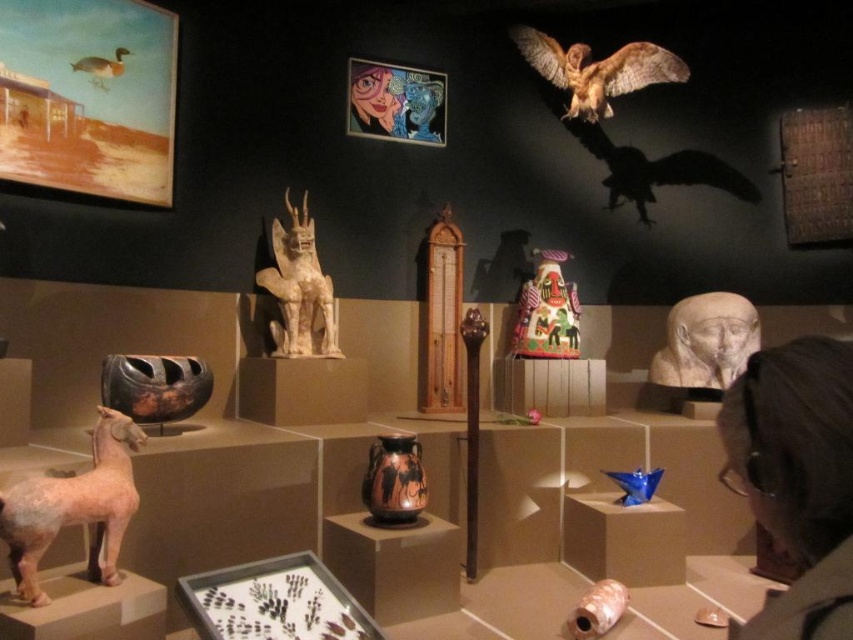
Question: Is dark hair at upper right above matte pink statue at lower left?

Choices:
 (A) yes
 (B) no

Answer: (A)

Question: Which point is farther to the camera?

Choices:
 (A) [x=721, y=413]
 (B) [x=648, y=365]
 (C) [x=570, y=294]

Answer: (B)

Question: Considering the relative positions of matte plastic mask at upper center and brown matte duck at upper left in the image provided, where is matte plastic mask at upper center located with respect to brown matte duck at upper left?

Choices:
 (A) below
 (B) above

Answer: (B)

Question: Which point is closer to the camera?

Choices:
 (A) (642, 84)
 (B) (276, 330)
 (C) (741, 330)
 (D) (572, 296)

Answer: (B)

Question: Can you confirm if matte pink statue at lower left is positioned above matte plastic mask at upper center?

Choices:
 (A) no
 (B) yes

Answer: (A)

Question: Based on their relative distances, which object is farther from the matte plastic mask at upper center?

Choices:
 (A) matte pink statue at lower left
 (B) brown matte duck at upper left

Answer: (A)